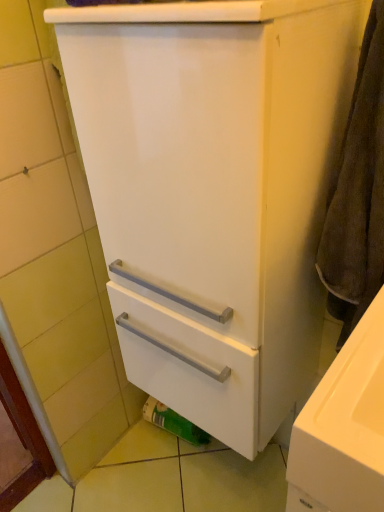
Question: From a real-world perspective, relative to brown textured towel at right, is green matte toilet paper at lower center vertically above or below?

Choices:
 (A) below
 (B) above

Answer: (A)

Question: Is green matte toilet paper at lower center in front of or behind brown textured towel at right in the image?

Choices:
 (A) behind
 (B) front

Answer: (A)

Question: From their relative heights in the image, would you say green matte toilet paper at lower center is taller or shorter than brown textured towel at right?

Choices:
 (A) short
 (B) tall

Answer: (A)

Question: Visually, is brown textured towel at right positioned to the left or to the right of green matte toilet paper at lower center?

Choices:
 (A) right
 (B) left

Answer: (A)

Question: In terms of size, does brown textured towel at right appear bigger or smaller than green matte toilet paper at lower center?

Choices:
 (A) small
 (B) big

Answer: (B)

Question: Considering their positions, is brown textured towel at right located in front of or behind green matte toilet paper at lower center?

Choices:
 (A) front
 (B) behind

Answer: (A)

Question: From the image's perspective, relative to green matte toilet paper at lower center, is brown textured towel at right above or below?

Choices:
 (A) below
 (B) above

Answer: (B)